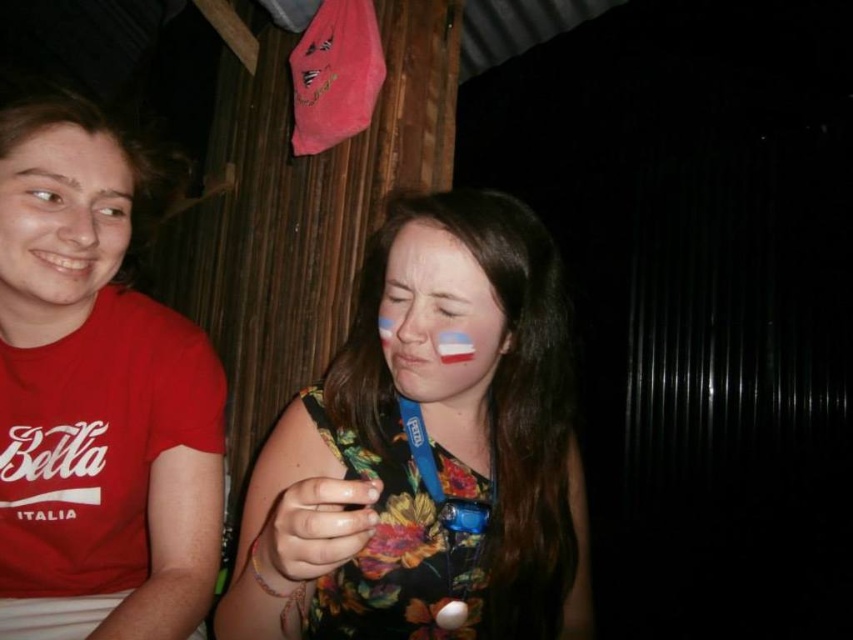
Which is more to the left, matte red t-shirt at left or white matte face paint at center?

matte red t-shirt at left is more to the left.

Who is positioned more to the right, matte red t-shirt at left or white matte face paint at center?

white matte face paint at center

Based on the photo, who is more forward, [56,173] or [426,321]?

Point [426,321] is more forward.

Locate an element on the screen. Image resolution: width=853 pixels, height=640 pixels. matte red t-shirt at left is located at coordinates (96, 397).

Is matte red shirt at left shorter than white matte face paint at center?

Incorrect, matte red shirt at left's height does not fall short of white matte face paint at center's.

Who is taller, matte red shirt at left or white matte face paint at center?

matte red shirt at left is taller.

Locate an element on the screen. This screenshot has width=853, height=640. matte red shirt at left is located at coordinates coord(62,216).

Which is above, floral fabric dress at center or white matte face paint at center?

white matte face paint at center is above.

Is floral fabric dress at center smaller than white matte face paint at center?

Incorrect, floral fabric dress at center is not smaller in size than white matte face paint at center.

Find the location of a particular element. Image resolution: width=853 pixels, height=640 pixels. floral fabric dress at center is located at coordinates (427, 449).